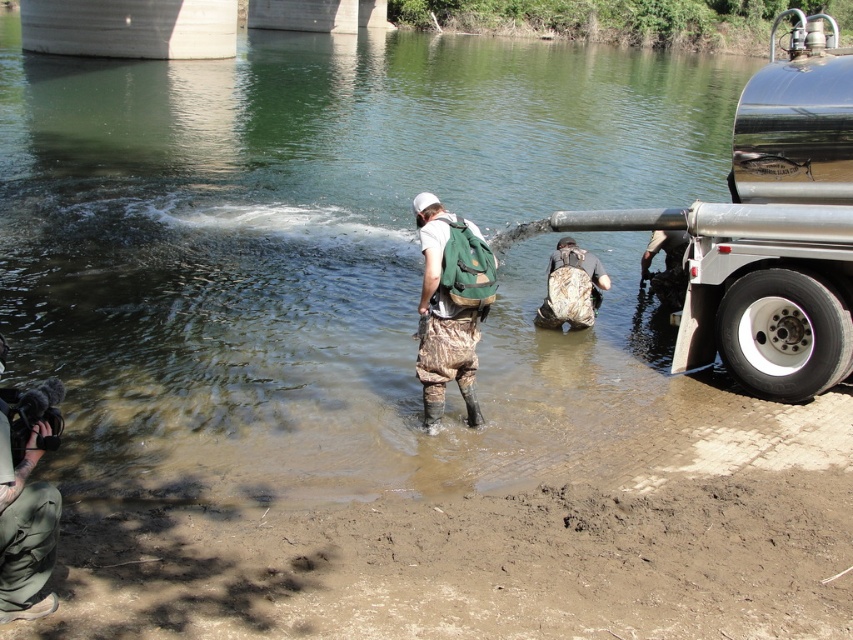
You are standing at the origin point of the coordinate system. There is a camouflage pants at center located at point [450,305]. If you want to walk towards the camouflage pants at center, in which direction should you move?

To reach the camouflage pants at center located at point [450,305] from the origin, you should move in the direction of the coordinates increasing in both the x and y axes since the point is in the positive quadrant relative to the origin.

Consider the image. You are a hiker who has just arrived at the riverbank. You see the shiny metallic trailer truck at right and the camouflage fabric backpack at center. Which object is closer to you?

The shiny metallic trailer truck at right is closer to you because it is in front of the camouflage fabric backpack at center.

Based on the scene description, what is the 2D coordinate of the brown muddy ground at lower left?

The brown muddy ground at lower left is located at the 2D coordinate point of (x=473, y=564).